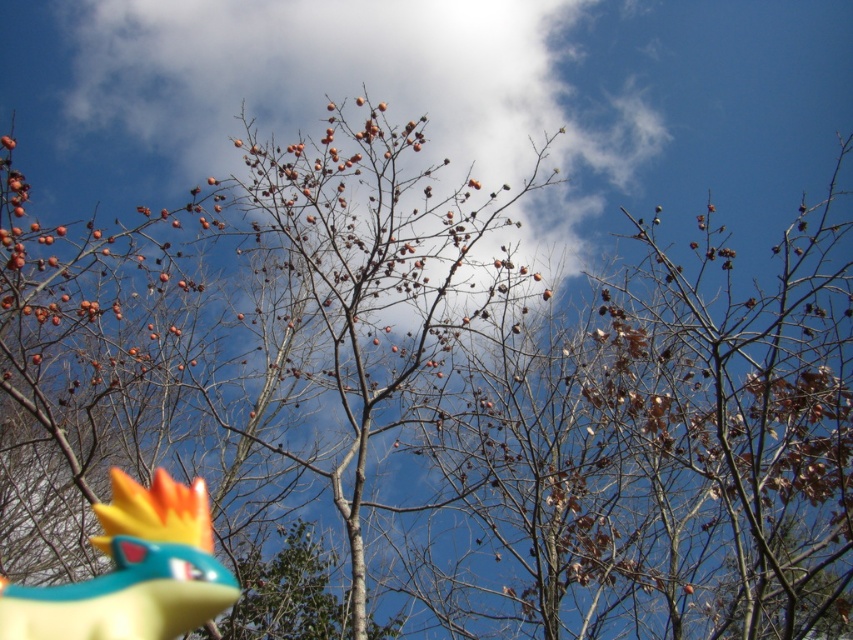
Can you confirm if white fluffy cloud at upper center is positioned to the left of yellow rubber toy at lower left?

Incorrect, white fluffy cloud at upper center is not on the left side of yellow rubber toy at lower left.

Find the location of a particular element. The height and width of the screenshot is (640, 853). white fluffy cloud at upper center is located at coordinates (338, 92).

Between point (194, 19) and point (3, 627), which one is positioned in front?

Point (3, 627)

Where is `white fluffy cloud at upper center`? This screenshot has width=853, height=640. white fluffy cloud at upper center is located at coordinates (338, 92).